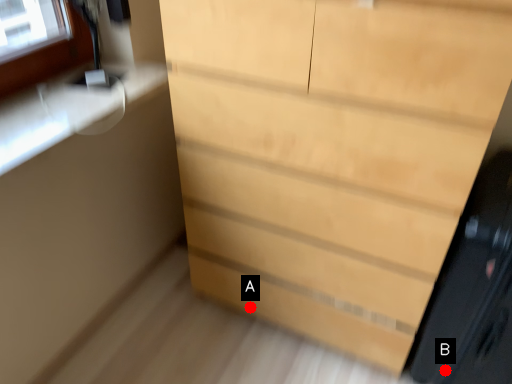
Question: Two points are circled on the image, labeled by A and B beside each circle. Which point is closer to the camera?

Choices:
 (A) A is closer
 (B) B is closer

Answer: (B)